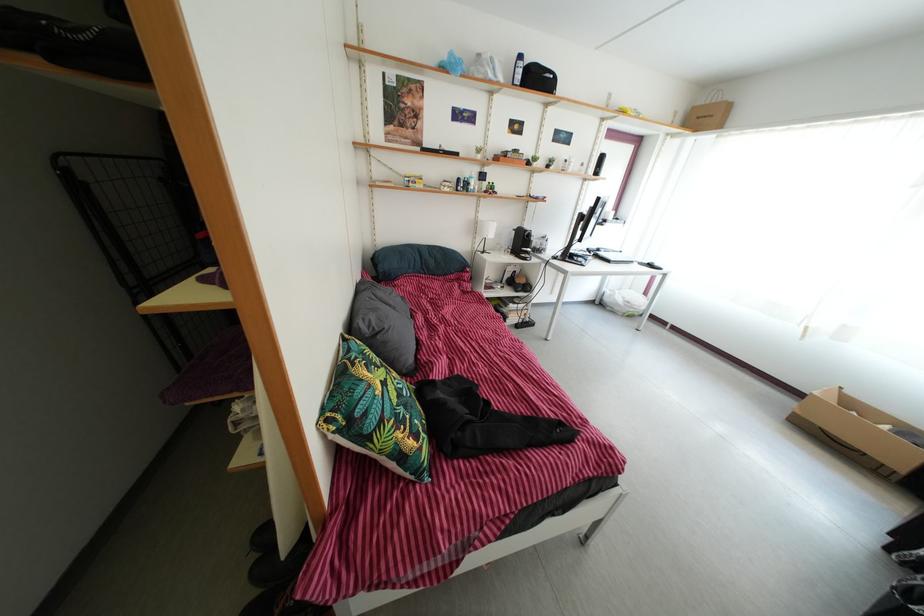
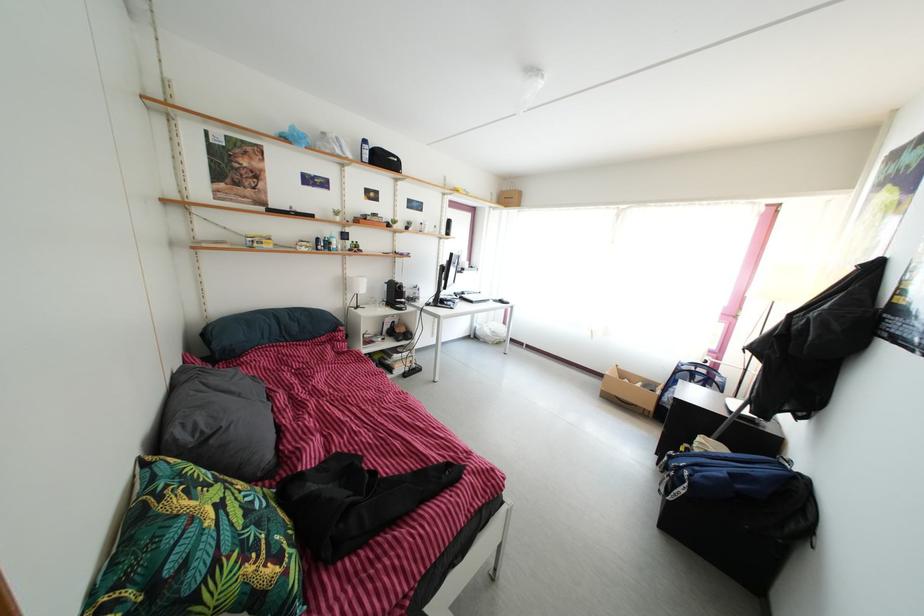
Locate, in the second image, the point that corresponds to point (384, 345) in the first image.

(217, 450)